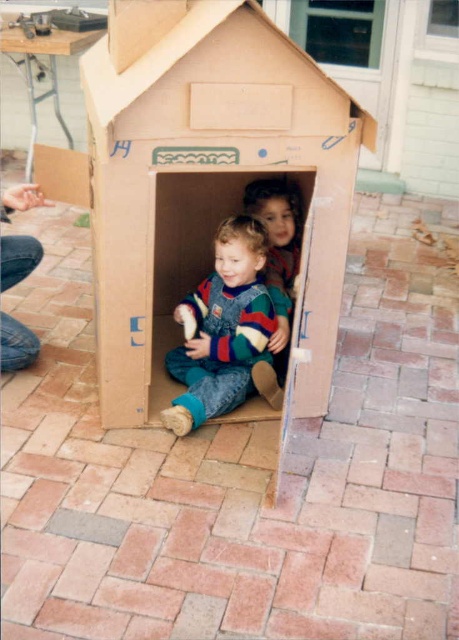
Question: Is matte blue overalls at center further to the viewer compared to striped sweater at center?

Choices:
 (A) yes
 (B) no

Answer: (B)

Question: Which object is positioned closest to the matte blue overalls at center?

Choices:
 (A) cardboard house at center
 (B) striped sweater at center

Answer: (B)

Question: Which object is positioned closest to the cardboard house at center?

Choices:
 (A) matte blue overalls at center
 (B) striped sweater at center

Answer: (A)

Question: Is cardboard house at center above matte blue overalls at center?

Choices:
 (A) no
 (B) yes

Answer: (B)

Question: Which point appears closest to the camera in this image?

Choices:
 (A) (182, 253)
 (B) (241, 349)
 (C) (287, 252)

Answer: (B)

Question: In this image, where is cardboard house at center located relative to matte blue overalls at center?

Choices:
 (A) above
 (B) below

Answer: (A)